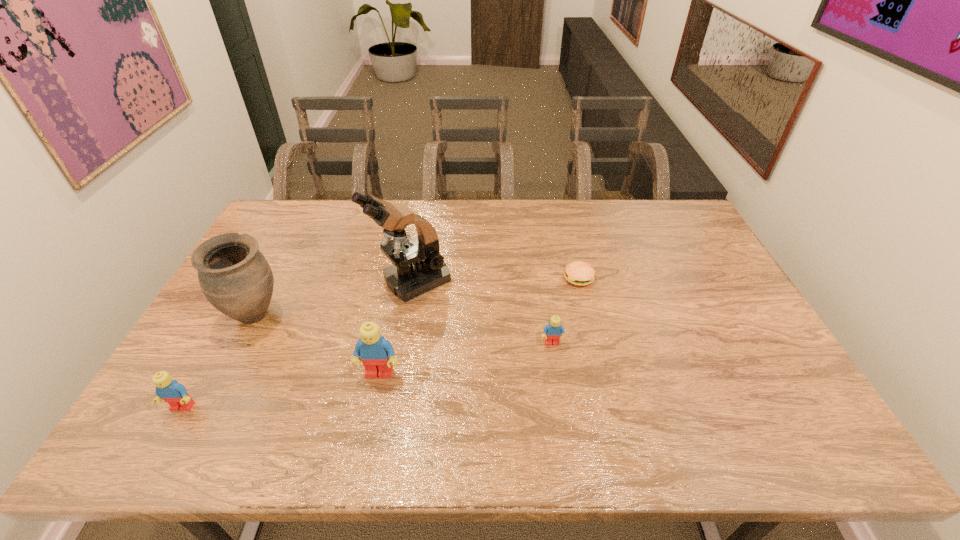
Please show where to add a Lego on the right while keeping spacing even. Please provide its 2D coordinates. Your answer should be formatted as a tuple, i.e. [(x, y)], where the tuple contains the x and y coordinates of a point satisfying the conditions above.

[(706, 317)]